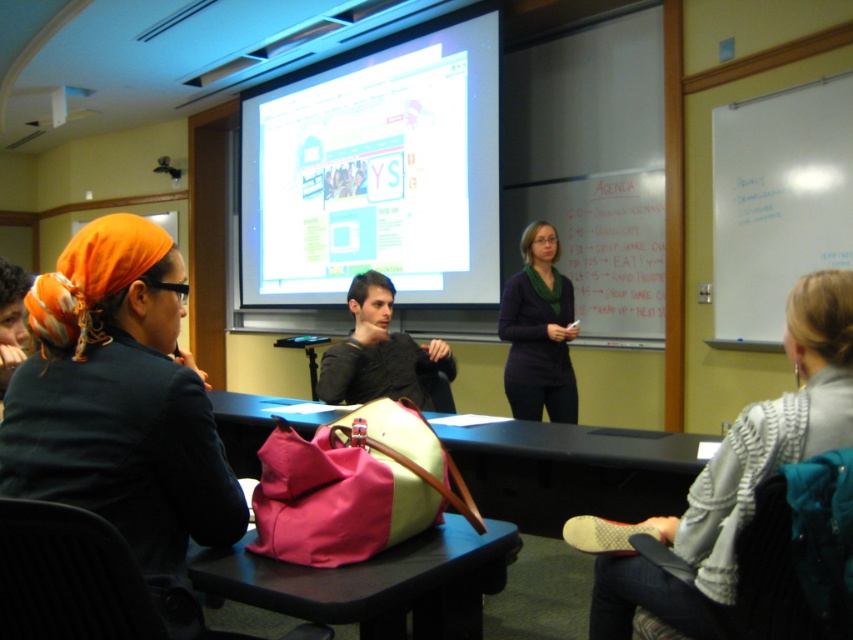
Question: Does matte white projector screen at upper center come behind white plastic projector at upper left?

Choices:
 (A) no
 (B) yes

Answer: (A)

Question: Which of the following is the closest to the observer?

Choices:
 (A) (508, 376)
 (B) (61, 92)
 (C) (485, 38)

Answer: (A)

Question: Can you confirm if dark purple sweater at center is positioned to the right of white plastic projector at upper left?

Choices:
 (A) no
 (B) yes

Answer: (B)

Question: Which point appears farthest from the camera in this image?

Choices:
 (A) (460, 624)
 (B) (254, 177)
 (C) (529, 230)

Answer: (B)

Question: Which is farther from the matte white projector screen at upper center?

Choices:
 (A) white plastic projector at upper left
 (B) pink fabric bag at center
 (C) striped sweater at lower right

Answer: (B)

Question: Is matte white projector screen at upper center further to camera compared to white plastic projector at upper left?

Choices:
 (A) yes
 (B) no

Answer: (B)